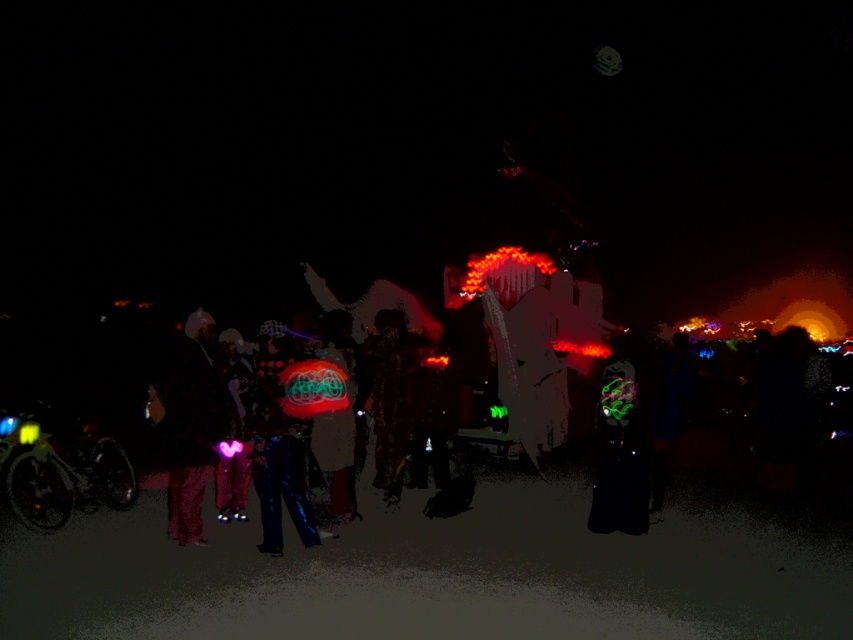
Question: Among these points, which one is nearest to the camera?

Choices:
 (A) (193, 493)
 (B) (271, 355)

Answer: (B)

Question: Can you confirm if pink fabric at center is positioned to the right of shiny blue pants at center?

Choices:
 (A) no
 (B) yes

Answer: (A)

Question: Considering the relative positions of pink fabric at center and shiny blue pants at center in the image provided, where is pink fabric at center located with respect to shiny blue pants at center?

Choices:
 (A) right
 (B) left

Answer: (B)

Question: Which point is closer to the camera?

Choices:
 (A) (312, 518)
 (B) (183, 545)

Answer: (A)

Question: Does pink fabric at center have a lesser width compared to shiny blue pants at center?

Choices:
 (A) no
 (B) yes

Answer: (A)